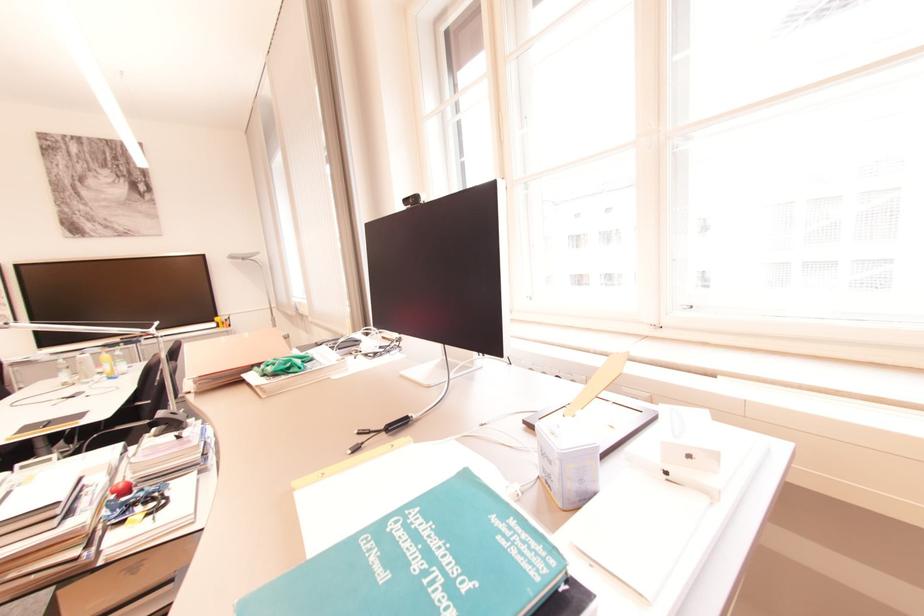
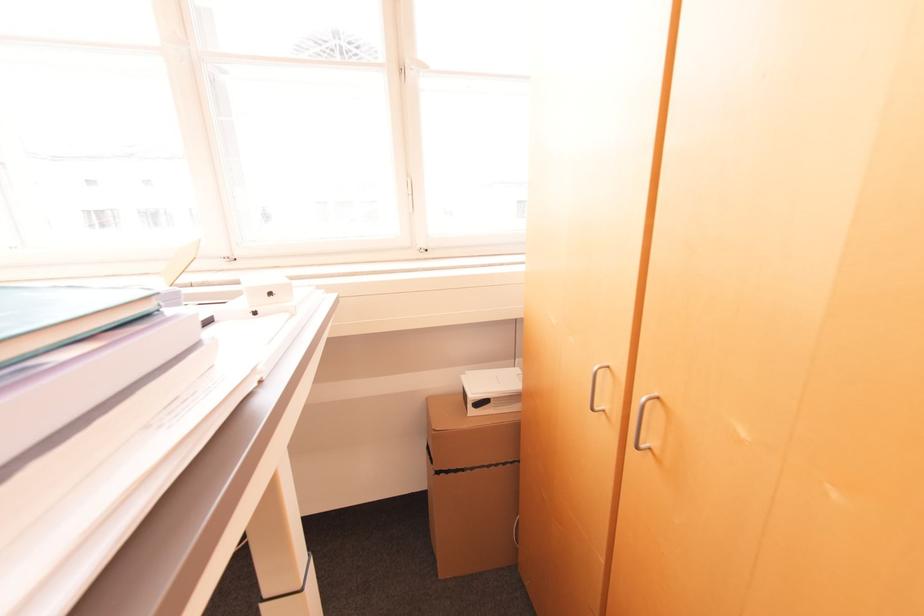
Question: The camera is either moving clockwise (left) or counter-clockwise (right) around the object. The first image is from the beginning of the video and the second image is from the end. Is the camera moving left or right when shooting the video?

Choices:
 (A) Left
 (B) Right

Answer: (A)